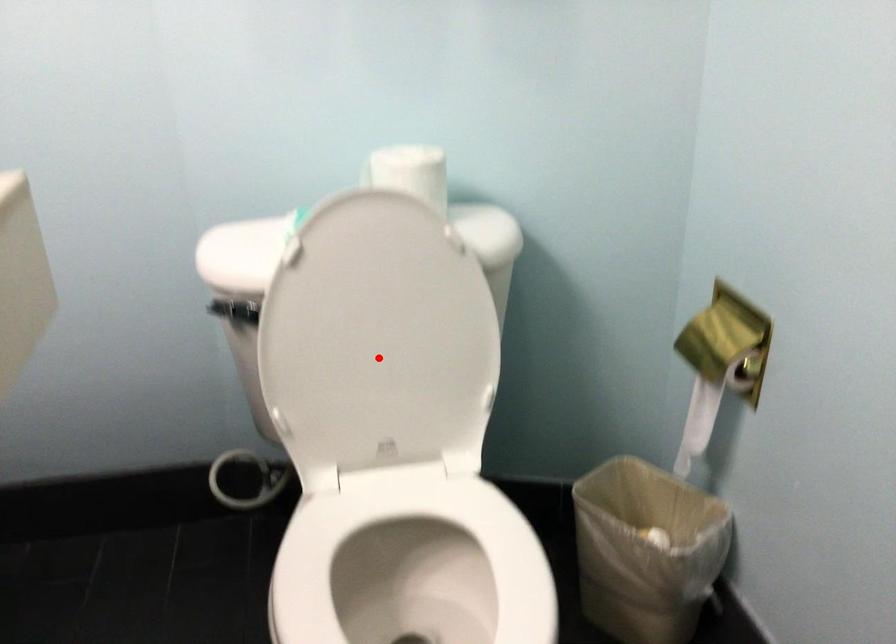
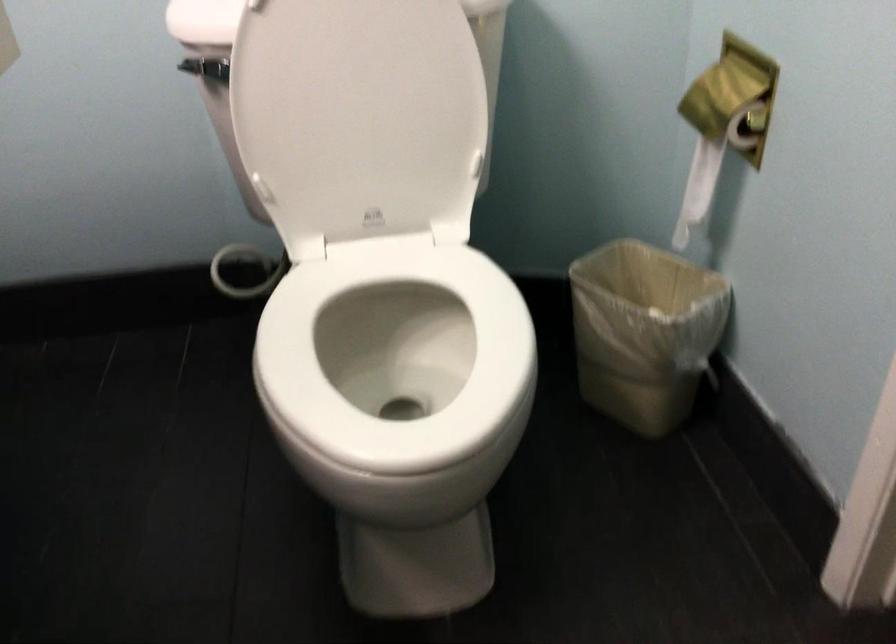
Where in the second image is the point corresponding to the highlighted location from the first image?

(359, 114)